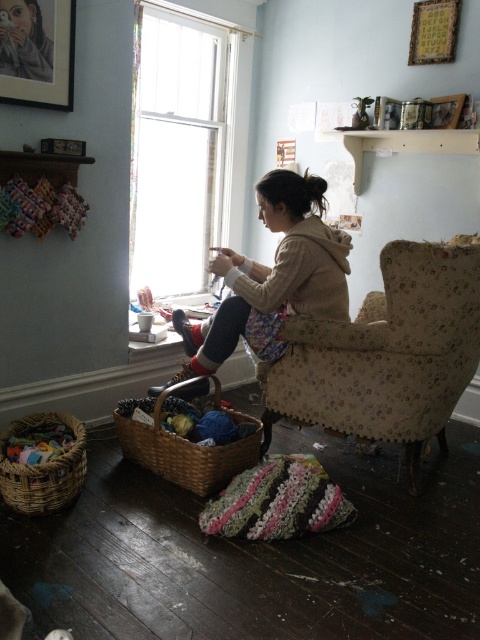
Question: Does matte beige hoodie at center have a smaller size compared to woven brown basket at lower left?

Choices:
 (A) yes
 (B) no

Answer: (B)

Question: Which of the following is the closest to the observer?

Choices:
 (A) (167, 179)
 (B) (10, 3)
 (C) (420, 45)
 (D) (320, 314)

Answer: (B)

Question: Which object is the farthest from the matte beige hoodie at center?

Choices:
 (A) brushed metal picture frame at upper left
 (B) woven brown basket at lower left
 (C) wooden picture frame at upper right

Answer: (C)

Question: Can you confirm if matte beige hoodie at center is wider than woven brown basket at lower left?

Choices:
 (A) no
 (B) yes

Answer: (B)

Question: Which of the following is the farthest from the observer?

Choices:
 (A) floral fabric armchair at center
 (B) woven brown basket at lower left
 (C) brushed metal picture frame at upper left
 (D) matte beige hoodie at center

Answer: (D)

Question: In this image, where is matte beige hoodie at center located relative to woven brown basket at lower center?

Choices:
 (A) left
 (B) right

Answer: (B)